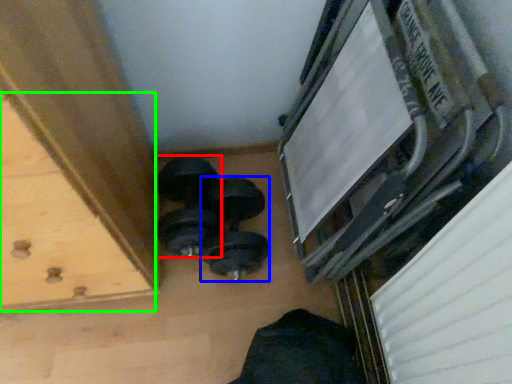
Question: Which is nearer to the dumbbell (highlighted by a red box)? dumbbell (highlighted by a blue box) or drawer (highlighted by a green box).

Choices:
 (A) dumbbell
 (B) drawer

Answer: (A)